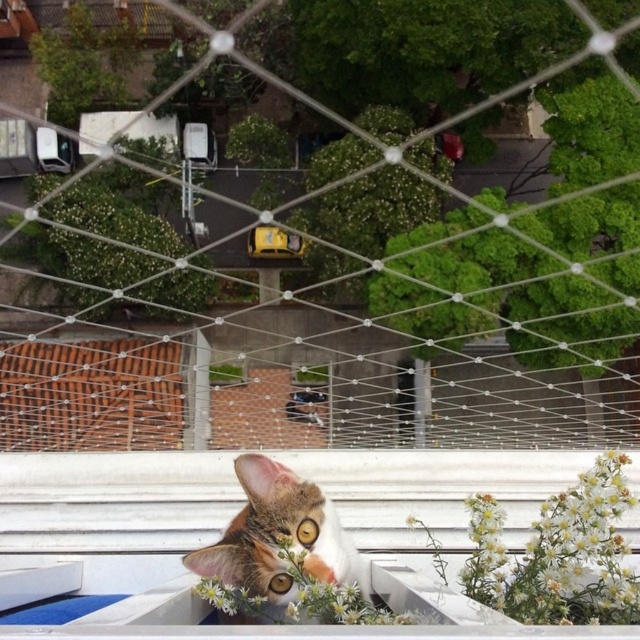
Can you confirm if white mesh netting at center is positioned above tabby fur cat at center?

Indeed, white mesh netting at center is positioned over tabby fur cat at center.

Does white mesh netting at center have a greater width compared to tabby fur cat at center?

Yes, white mesh netting at center is wider than tabby fur cat at center.

Which is behind, point (326, 109) or point (301, 545)?

Positioned behind is point (326, 109).

Locate an element on the screen. white mesh netting at center is located at coordinates (332, 314).